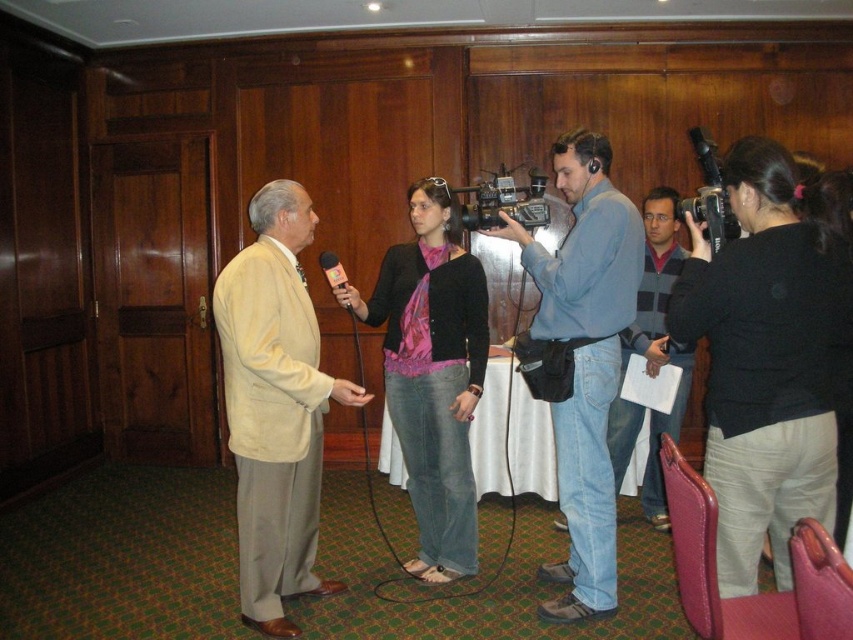
You are a photographer setting up for an interview photo shoot. You need to ensure that both the blue denim jeans at center and the blue jeans at center are visible in the frame. However, the camera lens has a limited depth of field. Which of the two should you focus on to ensure the taller one is in focus?

The blue denim jeans at center is much taller than the blue jeans at center, so you should focus on the blue denim jeans at center to ensure it is in focus.

Looking at this image, you are a fashion designer observing an interview scene. You notice the beige fabric suit at center and the blue denim jeans at center. Which clothing item has a larger size?

The beige fabric suit at center is bigger than the blue denim jeans at center.